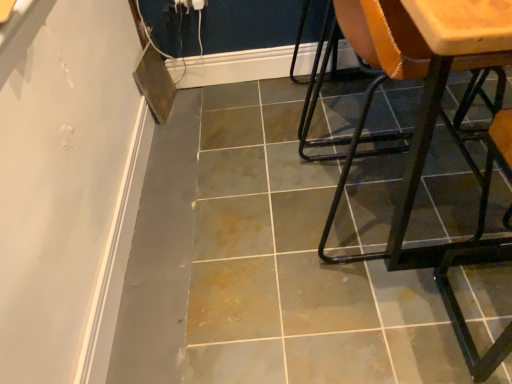
The width and height of the screenshot is (512, 384). I want to click on vacant region to the left of wooden seat at right, arranged as the 1th chair when viewed from the right, so click(230, 196).